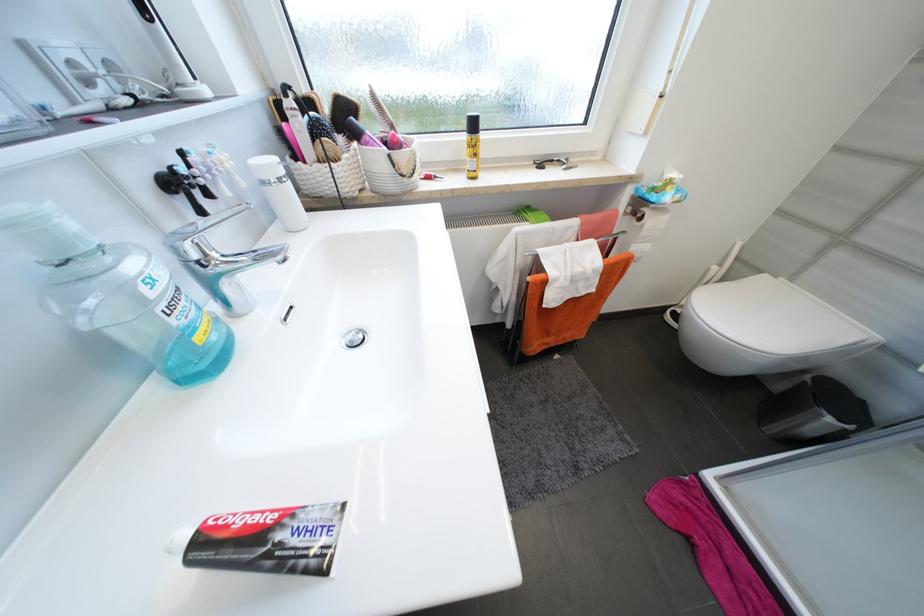
Find where to push the dispenser pump top. Please return your answer as a coordinate pair (x, y).

(43, 232)